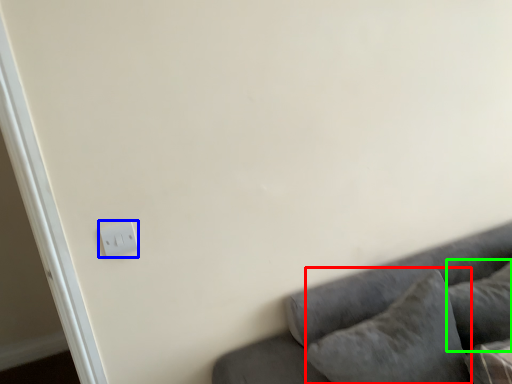
Question: Based on their relative distances, which object is farther from pillow (highlighted by a red box)? Choose from light switch (highlighted by a blue box) and pillow (highlighted by a green box).

Choices:
 (A) light switch
 (B) pillow

Answer: (A)